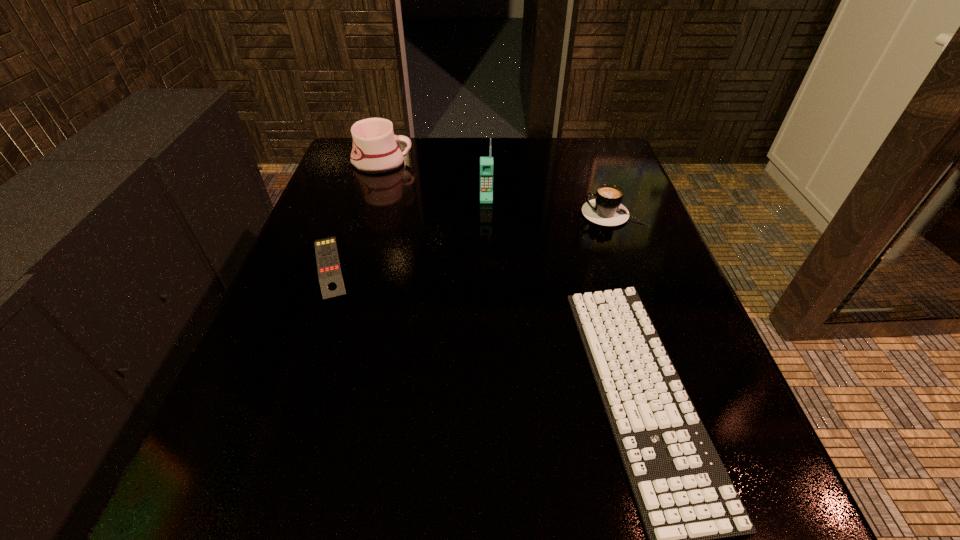
Where is `free region located with the handle on the side of the cappuccino`? The image size is (960, 540). free region located with the handle on the side of the cappuccino is located at coordinates (447, 214).

Identify the location of free space located 0.240m on the right of the remote control. The width and height of the screenshot is (960, 540). (477, 266).

You are a GUI agent. You are given a task and a screenshot of the screen. Output one action in this format:
    pyautogui.click(x=<x>, y=<y>)
    Task: Click on the object that is positioned at the far edge
    The height and width of the screenshot is (540, 960).
    Given the screenshot: What is the action you would take?
    pyautogui.click(x=375, y=150)

You are a GUI agent. You are given a task and a screenshot of the screen. Output one action in this format:
    pyautogui.click(x=<x>, y=<y>)
    Task: Click on the mug present at the left edge
    Image resolution: width=960 pixels, height=540 pixels.
    Given the screenshot: What is the action you would take?
    pyautogui.click(x=375, y=150)

Identify the location of remote control that is at the left edge. Image resolution: width=960 pixels, height=540 pixels. (330, 276).

Find the location of `object located at the right edge`. object located at the right edge is located at coordinates (606, 209).

The height and width of the screenshot is (540, 960). Find the location of `object present at the far left corner`. object present at the far left corner is located at coordinates (375, 150).

Find the location of a particular element. The height and width of the screenshot is (540, 960). vacant space at the near edge of the desktop is located at coordinates (589, 482).

Identify the location of vacant space at the left edge. The width and height of the screenshot is (960, 540). (377, 192).

Find the location of `free space at the far left corner of the desktop`. free space at the far left corner of the desktop is located at coordinates (391, 173).